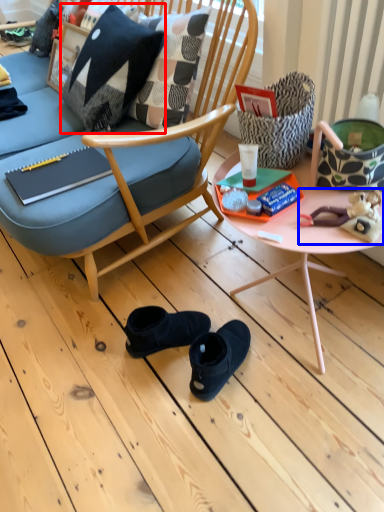
Question: Which object appears farthest to the camera in this image, pillow (highlighted by a red box) or stuff (highlighted by a blue box)?

Choices:
 (A) pillow
 (B) stuff

Answer: (A)